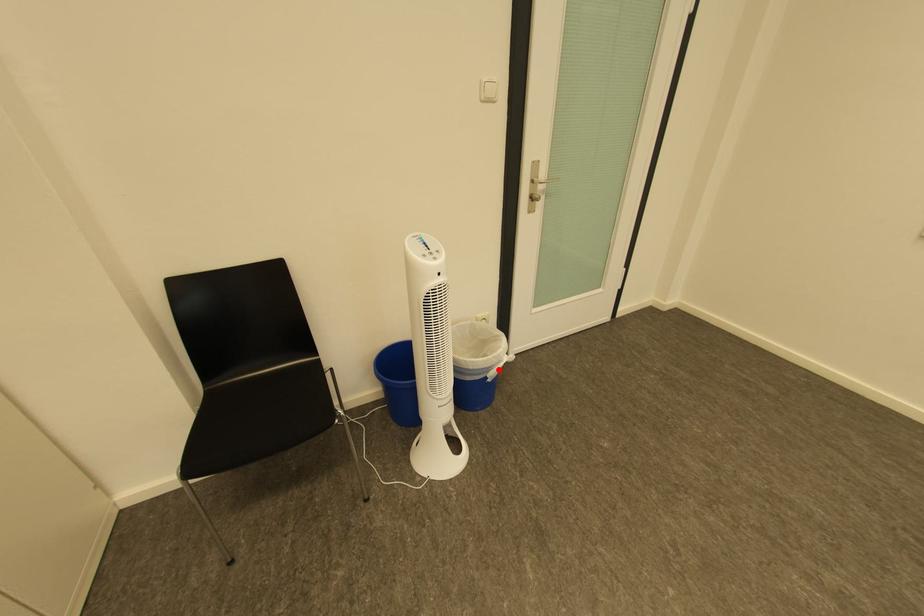
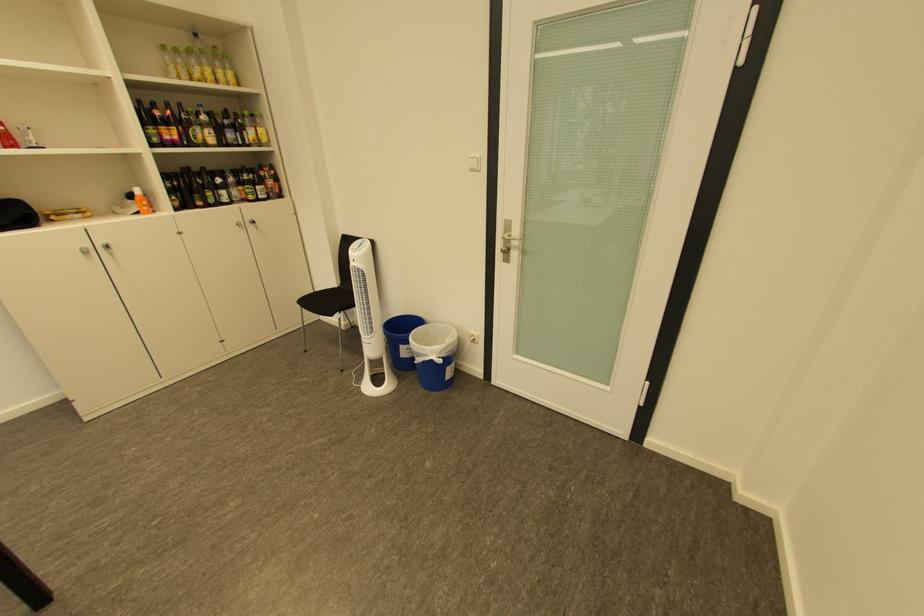
Question: I am providing you with two images of the same scene from different viewpoints. A red point is marked on the first image. At the location where the point appears in image 1, is it still visible in image 2?

Choices:
 (A) Yes
 (B) No

Answer: (A)